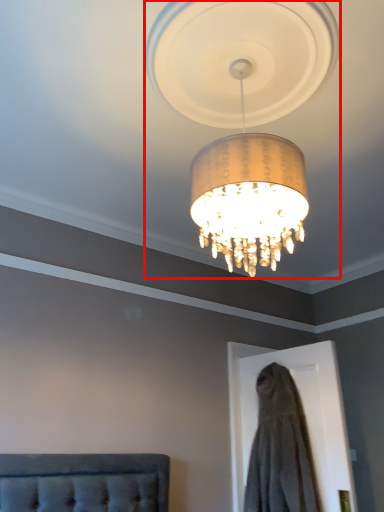
Question: Where is lamp (annotated by the red box) located in relation to dress in the image?

Choices:
 (A) right
 (B) left

Answer: (B)